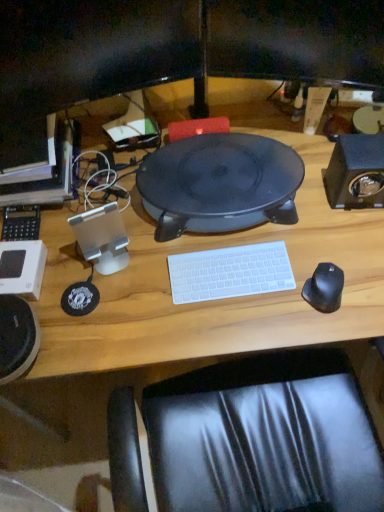
Where is `vacant region to the left of white plastic keyboard at center`? This screenshot has width=384, height=512. vacant region to the left of white plastic keyboard at center is located at coordinates (145, 283).